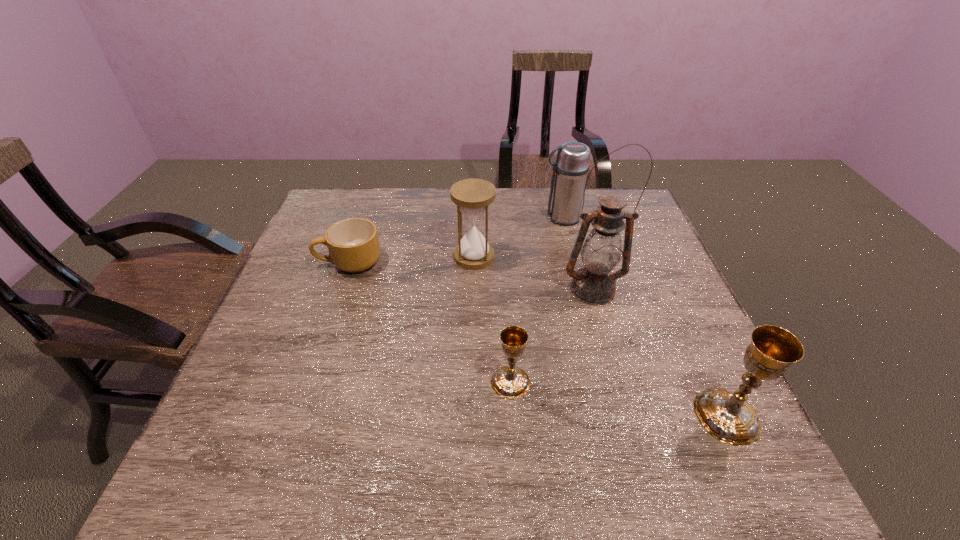
Find the location of a particular element. free space between the mug and the left chalice is located at coordinates pos(430,322).

I want to click on unoccupied position between the right chalice and the hourglass, so [x=600, y=336].

Where is `free space between the shorter chalice and the hourglass`? The width and height of the screenshot is (960, 540). free space between the shorter chalice and the hourglass is located at coordinates (492, 320).

The image size is (960, 540). What are the coordinates of `free spot between the shorter chalice and the tallest object` in the screenshot? It's located at (552, 336).

The height and width of the screenshot is (540, 960). What are the coordinates of `vacant area that lies between the tallest object and the rightmost object` in the screenshot? It's located at (660, 353).

Find the location of a particular element. The height and width of the screenshot is (540, 960). empty location between the shorter chalice and the taller chalice is located at coordinates (618, 399).

Locate an element on the screen. The height and width of the screenshot is (540, 960). object identified as the closest to the hourglass is located at coordinates click(x=594, y=284).

Find the location of a particular element. The height and width of the screenshot is (540, 960). object identified as the fourth closest to the right chalice is located at coordinates (571, 167).

At what (x,y) coordinates should I click in order to perform the action: click on free region that satisfies the following two spatial constraints: 1. with a handle on the side of the oil lamp; 2. on the left side of the thermos bottle. Please return your answer as a coordinate pair (x, y). Looking at the image, I should click on (578, 289).

Where is `free location that satisfies the following two spatial constraints: 1. on the back side of the oil lamp; 2. with a handle on the side of the thermos bottle`? The image size is (960, 540). free location that satisfies the following two spatial constraints: 1. on the back side of the oil lamp; 2. with a handle on the side of the thermos bottle is located at coordinates (573, 218).